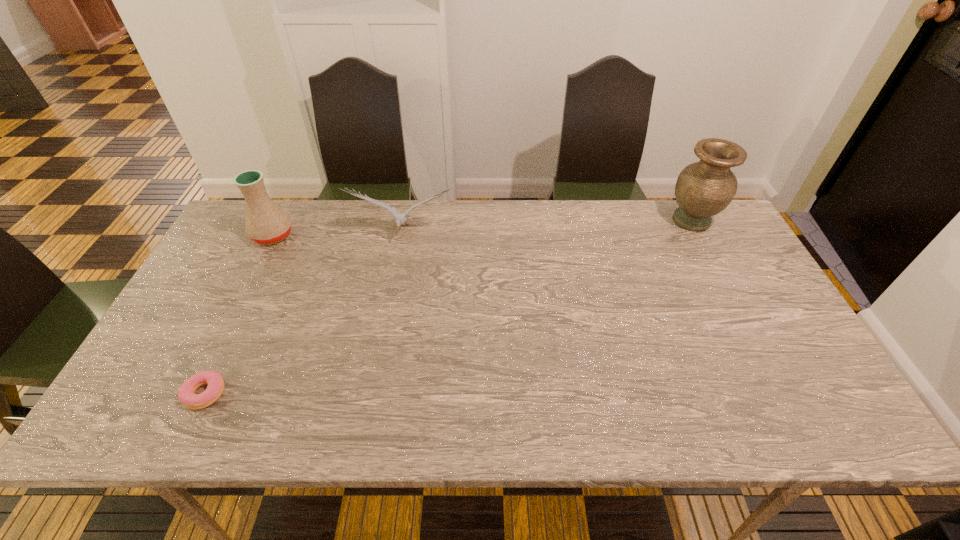
Where is `free space between the doughnut and the gull`? This screenshot has width=960, height=540. free space between the doughnut and the gull is located at coordinates (304, 313).

Locate an element on the screen. The width and height of the screenshot is (960, 540). free point between the third tallest object and the tallest object is located at coordinates coord(547,226).

Identify the location of free point between the third shortest object and the second object from right to left. Image resolution: width=960 pixels, height=540 pixels. [x=338, y=234].

Where is `free space between the vase and the third object from left to right`? Image resolution: width=960 pixels, height=540 pixels. free space between the vase and the third object from left to right is located at coordinates (547, 226).

Image resolution: width=960 pixels, height=540 pixels. What are the coordinates of `unoccupied position between the third shortest object and the third object from left to right` in the screenshot? It's located at (338, 234).

At what (x,y) coordinates should I click in order to perform the action: click on object that is the closest to the rightmost object. Please return your answer as a coordinate pair (x, y). Image resolution: width=960 pixels, height=540 pixels. Looking at the image, I should click on (400, 219).

I want to click on object that can be found as the third closest to the vase, so click(x=186, y=394).